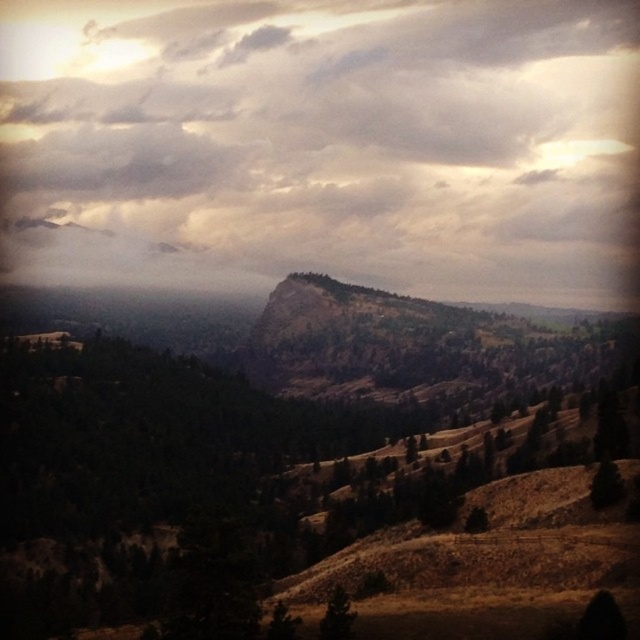
Question: Is the position of green matte tree at lower right less distant than that of green matte tree at center?

Choices:
 (A) yes
 (B) no

Answer: (A)

Question: Is cloudy sky at upper center closer to camera compared to green matte tree at center?

Choices:
 (A) no
 (B) yes

Answer: (A)

Question: Among these objects, which one is nearest to the camera?

Choices:
 (A) cloudy sky at upper center
 (B) green matte tree at center
 (C) green matte tree at lower right
 (D) green matte tree at lower center

Answer: (D)

Question: Estimate the real-world distances between objects in this image. Which object is farther from the green matte tree at lower center?

Choices:
 (A) cloudy sky at upper center
 (B) green matte tree at center

Answer: (A)

Question: Can you confirm if cloudy sky at upper center is smaller than green matte tree at center?

Choices:
 (A) yes
 (B) no

Answer: (B)

Question: Which point is farther to the camera?

Choices:
 (A) (611, 500)
 (B) (19, 22)

Answer: (B)